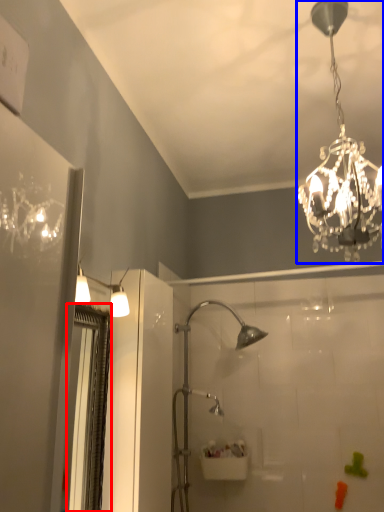
Question: Among these objects, which one is farthest to the camera, screen door (highlighted by a red box) or lamp (highlighted by a blue box)?

Choices:
 (A) screen door
 (B) lamp

Answer: (A)